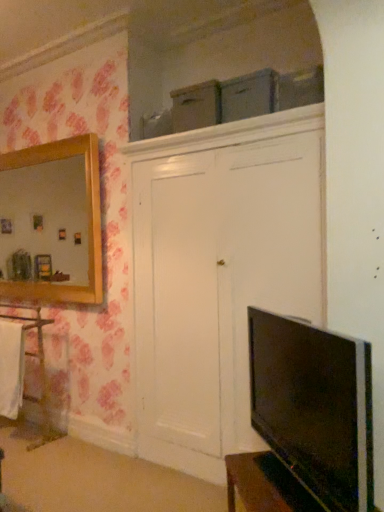
Question: Is point (11, 347) closer or farther from the camera than point (46, 418)?

Choices:
 (A) closer
 (B) farther

Answer: (A)

Question: Relative to white wood cabinet at left, is white fabric towel at left in front or behind?

Choices:
 (A) behind
 (B) front

Answer: (B)

Question: Which object is positioned farthest from the white wood cabinet at left?

Choices:
 (A) black glossy tv at lower right
 (B) shiny black vanity at lower right
 (C) white fabric towel at left

Answer: (A)

Question: Which object is positioned farthest from the white wood cabinet at left?

Choices:
 (A) white fabric towel at left
 (B) black glossy tv at lower right
 (C) shiny black vanity at lower right

Answer: (B)